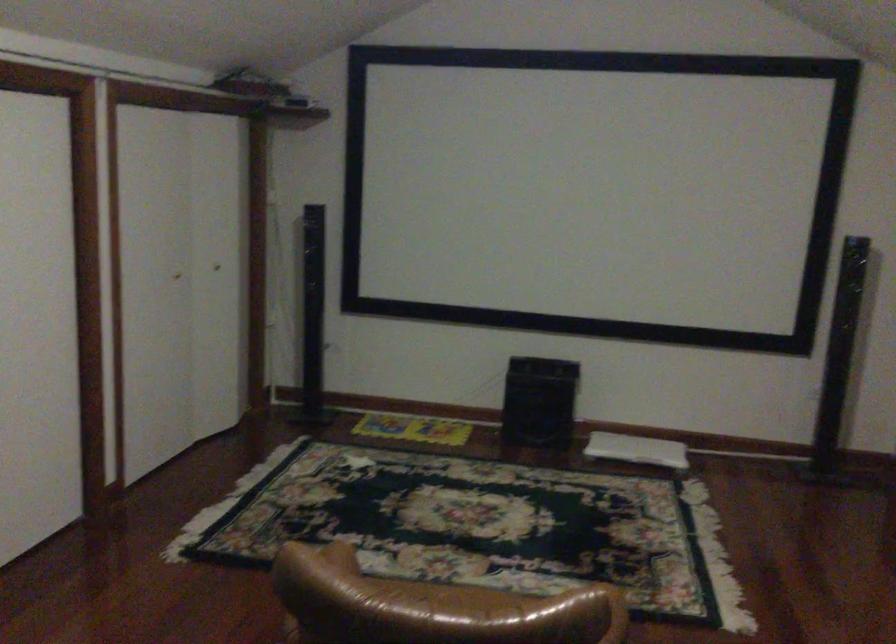
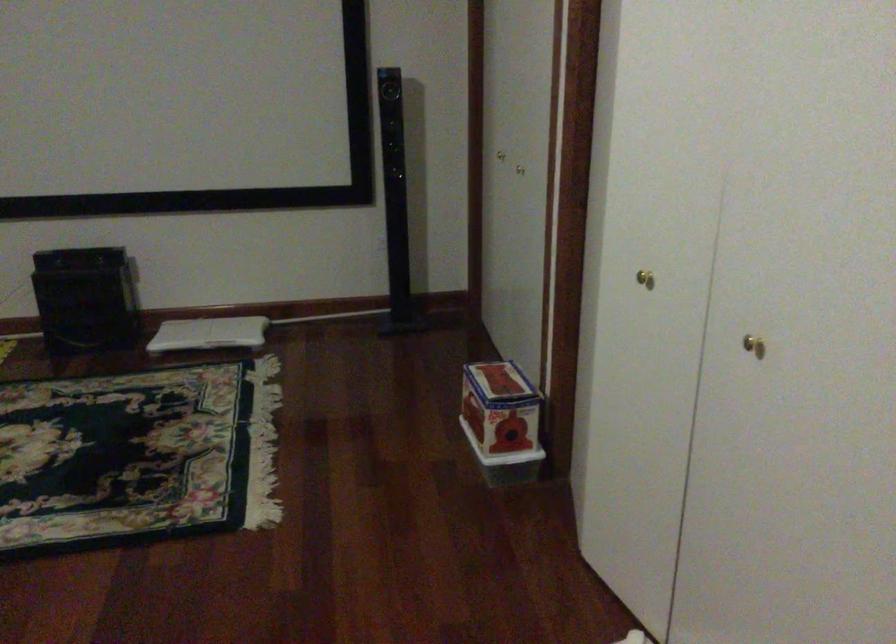
The point at (653, 450) is marked in the first image. Where is the corresponding point in the second image?

(209, 333)